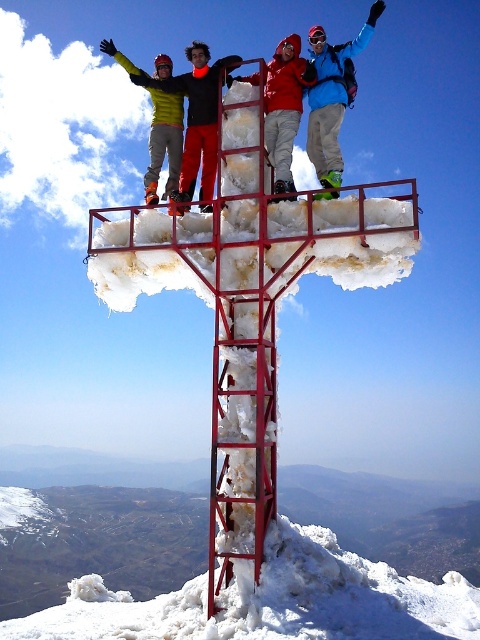
You are a photographer planning to take a photo of the white frosty snow at lower center and the matte red jacket at center. Which object should you focus on first if you want to capture both in sharp detail?

The white frosty snow at lower center is below the matte red jacket at center, so you should focus on the matte red jacket at center first to ensure both are in sharp detail since it is closer to the camera.